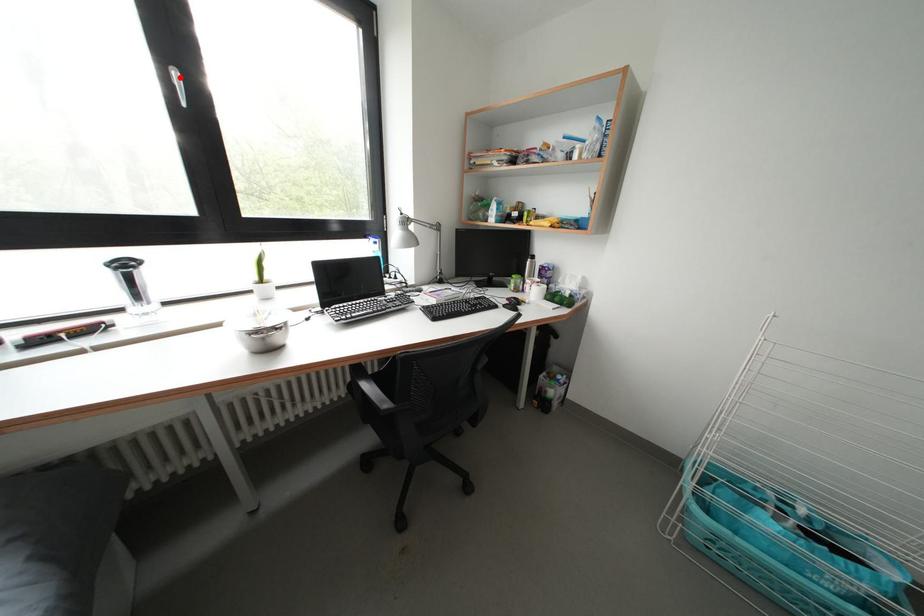
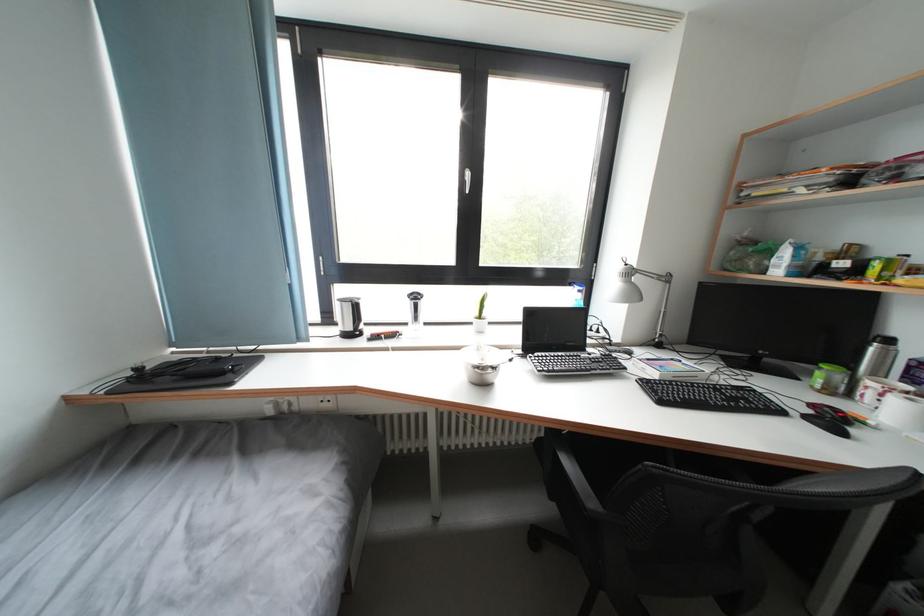
Question: A red point is marked in image1. In image2, is the corresponding 3D point closer to the camera or farther? Reply with the corresponding letter.

Choices:
 (A) The corresponding 3D point is closer.
 (B) The corresponding 3D point is farther.

Answer: (A)